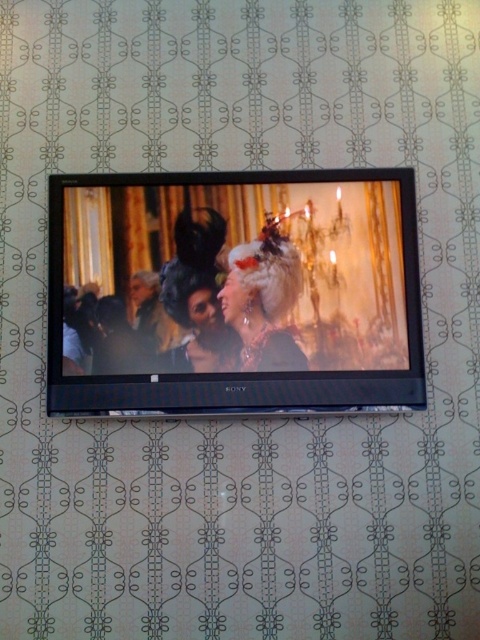
Question: Among these points, which one is farthest from the camera?

Choices:
 (A) (250, 257)
 (B) (385, 388)

Answer: (A)

Question: Does black glossy flat screen tv at center lie in front of shiny silver tiara at center?

Choices:
 (A) no
 (B) yes

Answer: (B)

Question: Does black glossy flat screen tv at center appear on the right side of shiny silver tiara at center?

Choices:
 (A) no
 (B) yes

Answer: (A)

Question: Observing the image, what is the correct spatial positioning of black glossy flat screen tv at center in reference to shiny silver tiara at center?

Choices:
 (A) above
 (B) below

Answer: (A)

Question: Among these objects, which one is farthest from the camera?

Choices:
 (A) black glossy flat screen tv at center
 (B) shiny silver tiara at center

Answer: (B)